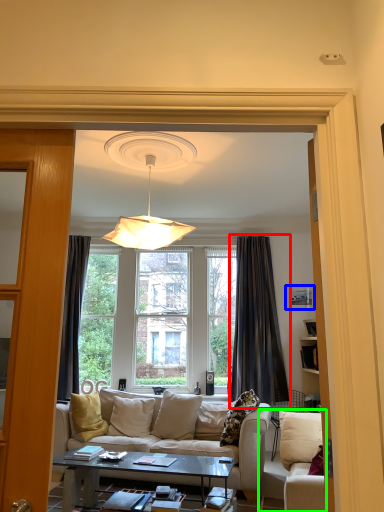
Question: Based on their relative distances, which object is nearer to curtain (highlighted by a red box)? Choose from picture frame (highlighted by a blue box) and studio couch (highlighted by a green box).

Choices:
 (A) picture frame
 (B) studio couch

Answer: (A)